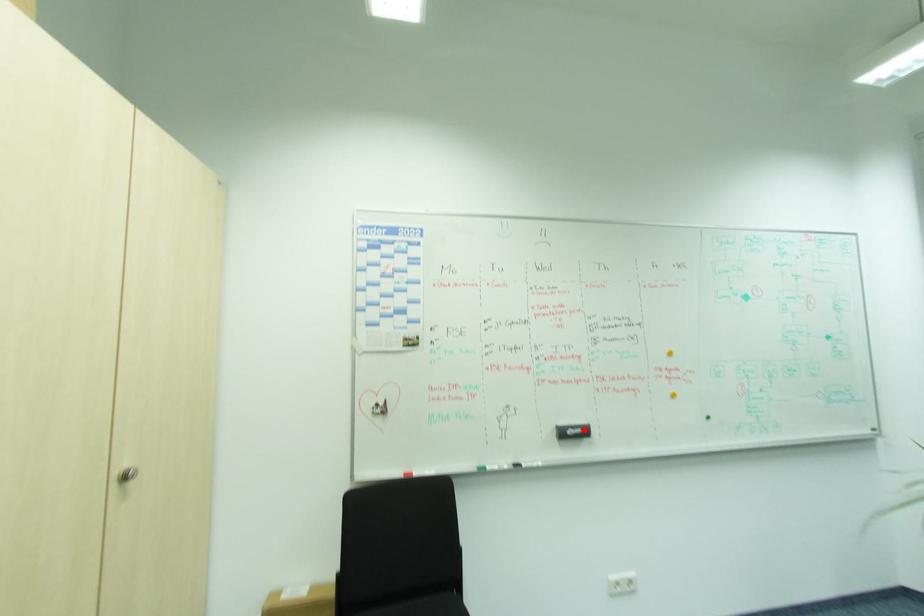
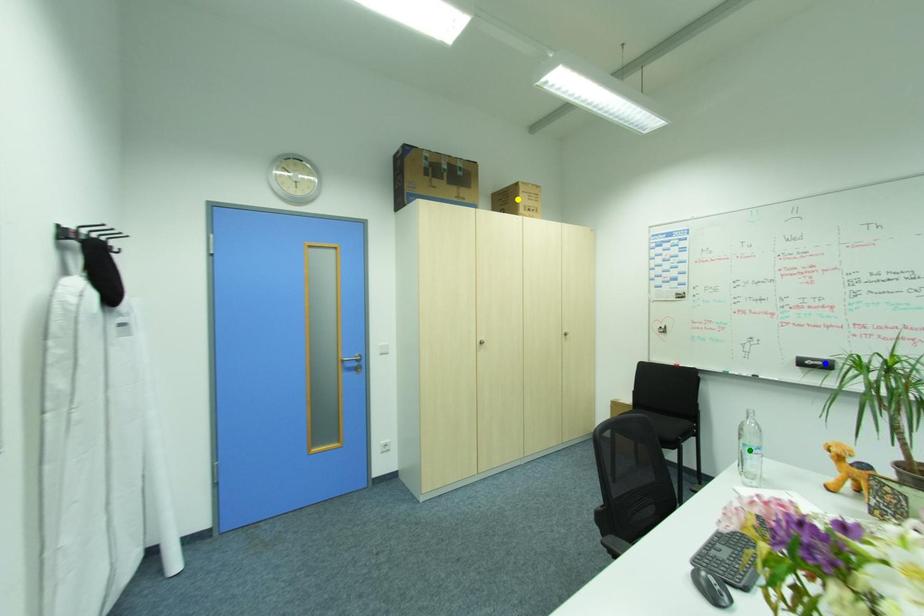
Question: I am providing you with two images of the same scene from different viewpoints. A red point is marked on the first image. You are given multiple points on the second image. Which point in image 2 represents the same 3d spot as the red point in image 1?

Choices:
 (A) blue point
 (B) yellow point
 (C) green point

Answer: (A)